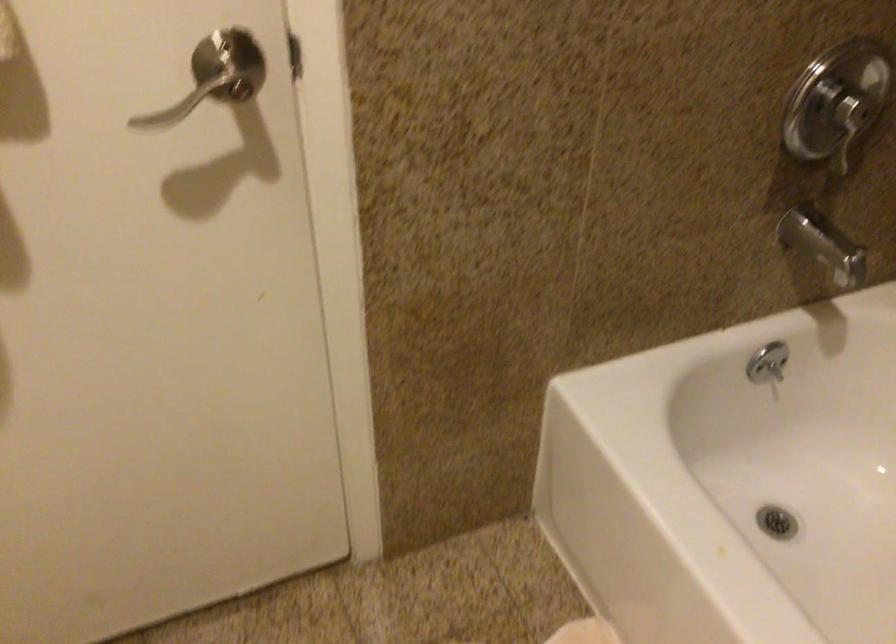
Image resolution: width=896 pixels, height=644 pixels. Describe the element at coordinates (776, 522) in the screenshot. I see `the drain overflow lever` at that location.